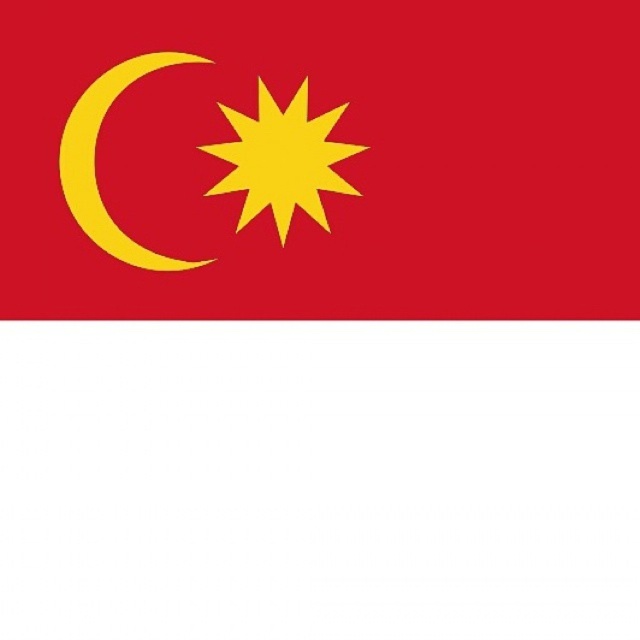
Who is lower down, matte red flag at upper left or matte yellow crescent at upper left?

Positioned lower is matte red flag at upper left.

Is matte red flag at upper left closer to camera compared to matte yellow crescent at upper left?

Yes, matte red flag at upper left is closer to the viewer.

Is point (513, 227) closer to camera compared to point (289, 227)?

Yes, it is.

Where is `matte red flag at upper left`? The image size is (640, 640). matte red flag at upper left is located at coordinates (317, 157).